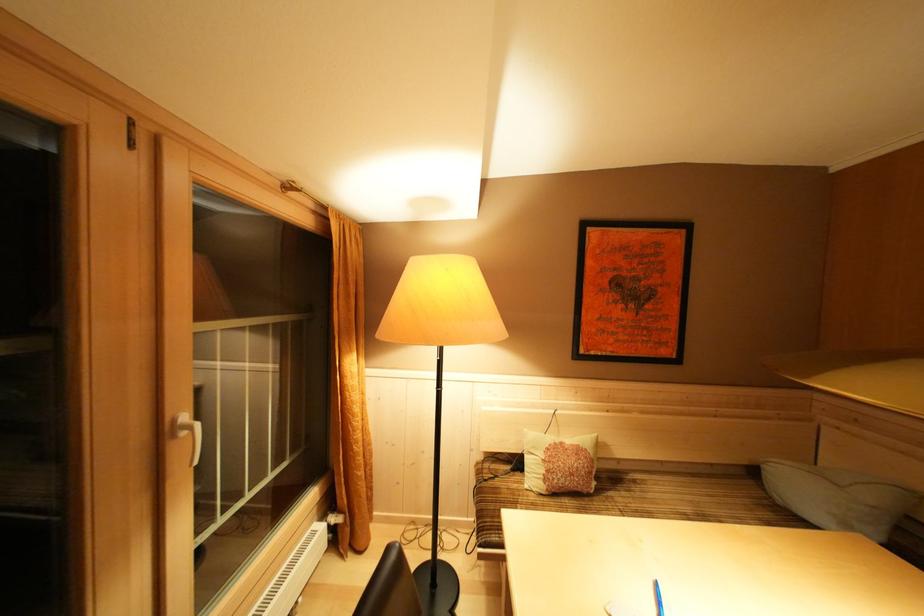
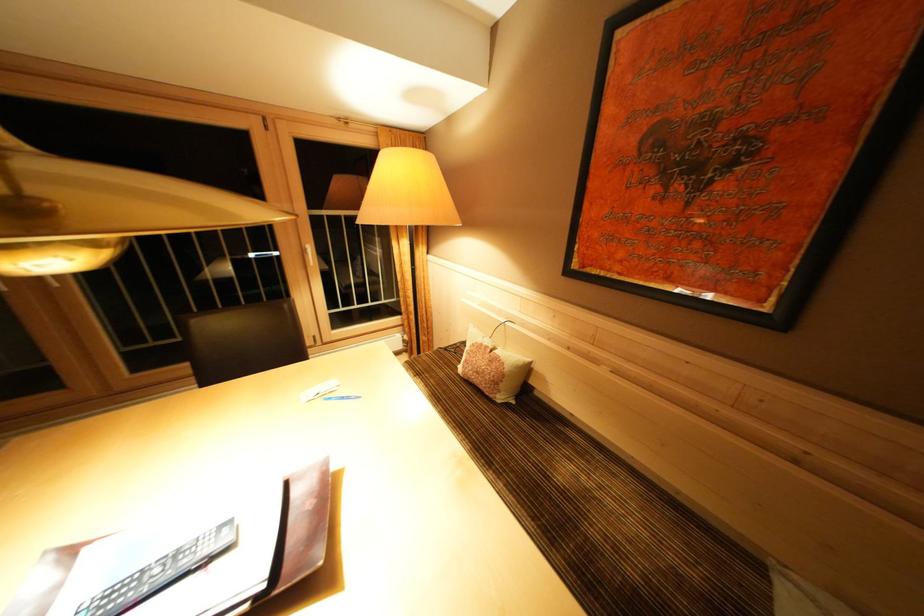
The point at (568, 448) is marked in the first image. Where is the corresponding point in the second image?

(493, 352)